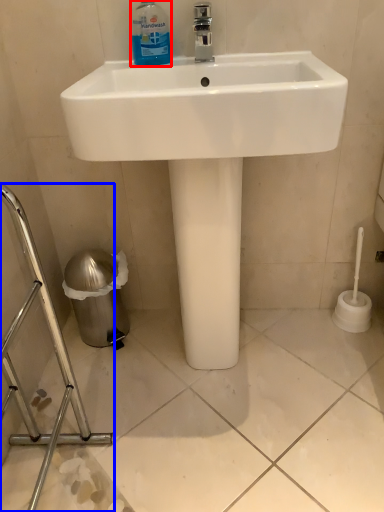
Question: Among these objects, which one is nearest to the camera, cleaning product (highlighted by a red box) or porcelain (highlighted by a blue box)?

Choices:
 (A) cleaning product
 (B) porcelain

Answer: (B)